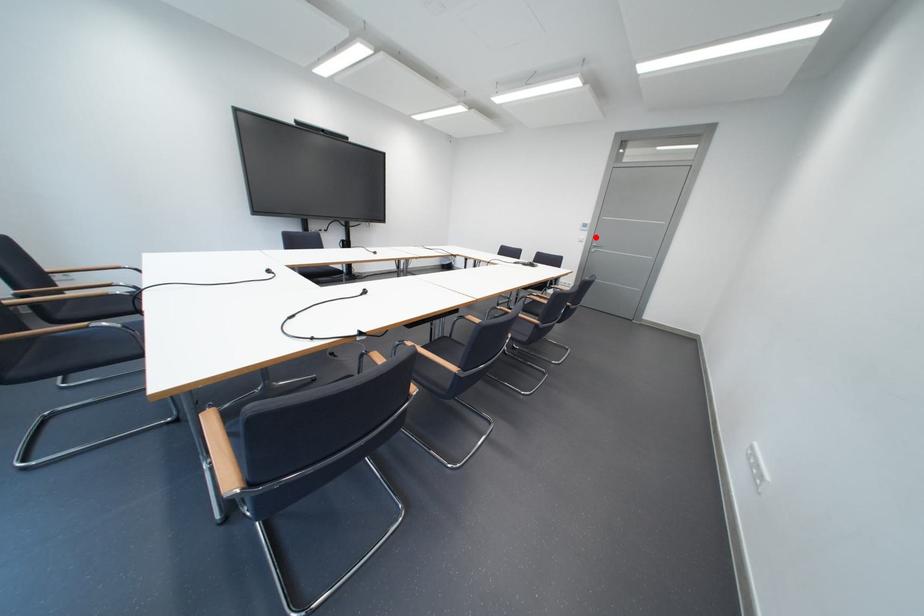
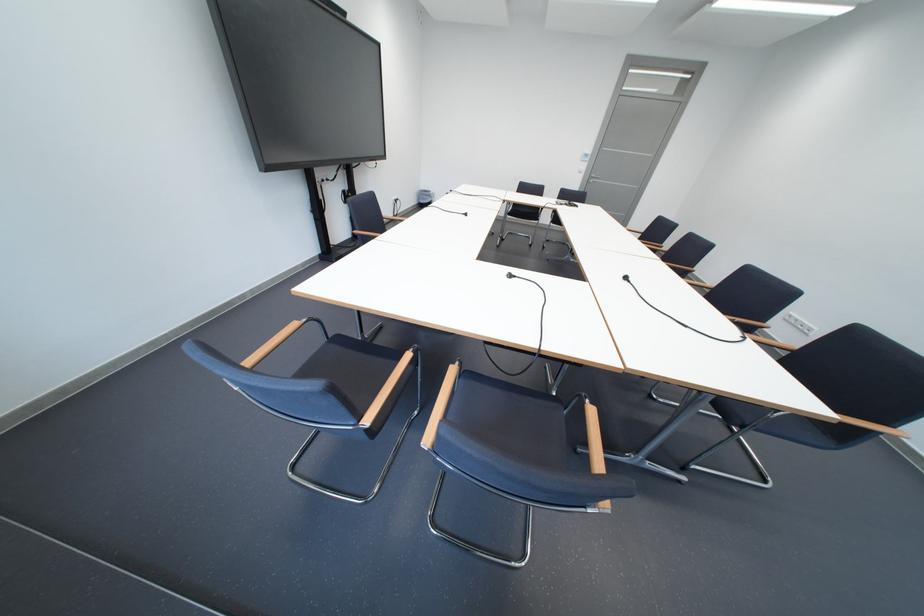
The point at the highlighted location is marked in the first image. Where is the corresponding point in the second image?

(596, 168)